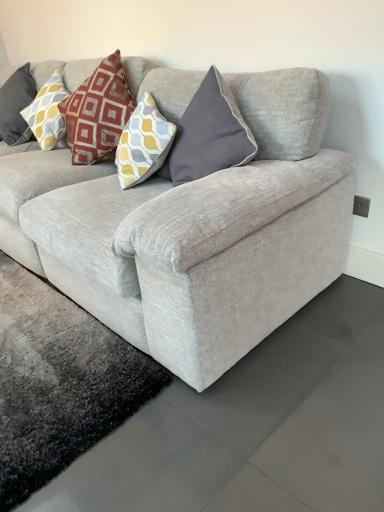
This screenshot has width=384, height=512. Describe the element at coordinates (193, 232) in the screenshot. I see `textured gray couch at center` at that location.

What are the coordinates of `textured gray couch at center` in the screenshot? It's located at (193, 232).

This screenshot has width=384, height=512. Describe the element at coordinates (47, 113) in the screenshot. I see `matte yellow and gray diamond-patterned pillow at upper left` at that location.

Image resolution: width=384 pixels, height=512 pixels. Identify the location of matte yellow and gray diamond-patterned pillow at upper left. 47,113.

Where is `textured gray couch at center`? textured gray couch at center is located at coordinates (193, 232).

Which is more to the left, matte yellow and gray diamond-patterned pillow at upper left or textured gray couch at center?

From the viewer's perspective, matte yellow and gray diamond-patterned pillow at upper left appears more on the left side.

Which is behind, matte yellow and gray diamond-patterned pillow at upper left or textured gray couch at center?

matte yellow and gray diamond-patterned pillow at upper left is further away from the camera.

Is point (57, 110) closer or farther from the camera than point (271, 289)?

Point (57, 110) is positioned farther from the camera compared to point (271, 289).

From the image's perspective, is matte yellow and gray diamond-patterned pillow at upper left over textured gray couch at center?

Yes.

From a real-world perspective, is matte yellow and gray diamond-patterned pillow at upper left physically above textured gray couch at center?

Yes.

Considering the relative sizes of matte yellow and gray diamond-patterned pillow at upper left and textured gray couch at center in the image provided, is matte yellow and gray diamond-patterned pillow at upper left wider than textured gray couch at center?

In fact, matte yellow and gray diamond-patterned pillow at upper left might be narrower than textured gray couch at center.

Who is shorter, matte yellow and gray diamond-patterned pillow at upper left or textured gray couch at center?

matte yellow and gray diamond-patterned pillow at upper left is shorter.

Who is smaller, matte yellow and gray diamond-patterned pillow at upper left or textured gray couch at center?

matte yellow and gray diamond-patterned pillow at upper left.

Consider the image. Is matte yellow and gray diamond-patterned pillow at upper left surrounding textured gray couch at center?

No, matte yellow and gray diamond-patterned pillow at upper left does not contain textured gray couch at center.

Can you see matte yellow and gray diamond-patterned pillow at upper left touching textured gray couch at center?

They are not placed beside each other.

Does matte yellow and gray diamond-patterned pillow at upper left turn towards textured gray couch at center?

Yes, matte yellow and gray diamond-patterned pillow at upper left faces towards textured gray couch at center.

At what (x,y) coordinates should I click in order to perform the action: click on pillow above the textured gray couch at center (from a real-world perspective). Please return your answer as a coordinate pair (x, y). This screenshot has width=384, height=512. Looking at the image, I should click on (47, 113).

Can you confirm if textured gray couch at center is positioned to the left of matte yellow and gray diamond-patterned pillow at upper left?

No, textured gray couch at center is not to the left of matte yellow and gray diamond-patterned pillow at upper left.

Between textured gray couch at center and matte yellow and gray diamond-patterned pillow at upper left, which one is positioned behind?

matte yellow and gray diamond-patterned pillow at upper left is further from the camera.

Is point (148, 344) positioned behind point (53, 121)?

No, it is in front of (53, 121).

From the picture: From the image's perspective, does textured gray couch at center appear higher than matte yellow and gray diamond-patterned pillow at upper left?

No, from the image's perspective, textured gray couch at center is not on top of matte yellow and gray diamond-patterned pillow at upper left.

From a real-world perspective, is textured gray couch at center on top of matte yellow and gray diamond-patterned pillow at upper left?

No, from a real-world perspective, textured gray couch at center is not on top of matte yellow and gray diamond-patterned pillow at upper left.

Considering the sizes of textured gray couch at center and matte yellow and gray diamond-patterned pillow at upper left in the image, is textured gray couch at center wider or thinner than matte yellow and gray diamond-patterned pillow at upper left?

Clearly, textured gray couch at center has more width compared to matte yellow and gray diamond-patterned pillow at upper left.

Can you confirm if textured gray couch at center is taller than matte yellow and gray diamond-patterned pillow at upper left?

Correct, textured gray couch at center is much taller as matte yellow and gray diamond-patterned pillow at upper left.

Between textured gray couch at center and matte yellow and gray diamond-patterned pillow at upper left, which one has smaller size?

matte yellow and gray diamond-patterned pillow at upper left is smaller.

Would you say textured gray couch at center contains matte yellow and gray diamond-patterned pillow at upper left?

Yes, matte yellow and gray diamond-patterned pillow at upper left can be found within textured gray couch at center.

Is textured gray couch at center far away from matte yellow and gray diamond-patterned pillow at upper left?

textured gray couch at center is actually quite close to matte yellow and gray diamond-patterned pillow at upper left.

Is textured gray couch at center facing away from matte yellow and gray diamond-patterned pillow at upper left?

Yes, matte yellow and gray diamond-patterned pillow at upper left is at the back of textured gray couch at center.

How many degrees apart are the facing directions of textured gray couch at center and matte yellow and gray diamond-patterned pillow at upper left?

There is a 0.0484-degree angle between the facing directions of textured gray couch at center and matte yellow and gray diamond-patterned pillow at upper left.

The width and height of the screenshot is (384, 512). Identify the location of pillow above the textured gray couch at center (from a real-world perspective). (47, 113).

At what (x,y) coordinates should I click in order to perform the action: click on studio couch in front of the matte yellow and gray diamond-patterned pillow at upper left. Please return your answer as a coordinate pair (x, y). This screenshot has height=512, width=384. Looking at the image, I should click on (193, 232).

In order to click on pillow on the left side of textured gray couch at center in this screenshot , I will do `click(47, 113)`.